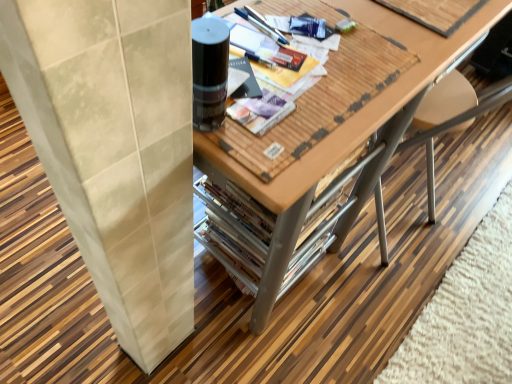
Locate an element on the screen. This screenshot has height=384, width=512. free spot behind matte black magazine at center, which ranks as the 2th magazine in back-to-front order is located at coordinates (297, 13).